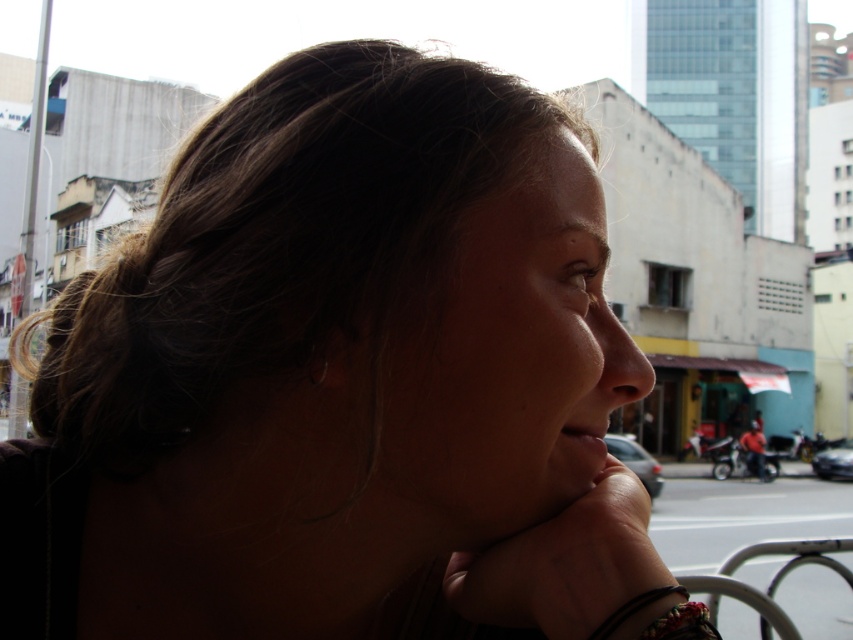
Can you confirm if smooth skin at lower center is wider than black leather bracelet at lower right?

In fact, smooth skin at lower center might be narrower than black leather bracelet at lower right.

Consider the image. Can you confirm if smooth skin at lower center is positioned below black leather bracelet at lower right?

Actually, smooth skin at lower center is above black leather bracelet at lower right.

You are a GUI agent. You are given a task and a screenshot of the screen. Output one action in this format:
    pyautogui.click(x=<x>, y=<y>)
    Task: Click on the smooth skin at lower center
    This screenshot has height=640, width=853.
    Given the screenshot: What is the action you would take?
    point(578,454)

Can you confirm if dark skin hand at lower center is thinner than silver metallic earring at upper left?

In fact, dark skin hand at lower center might be wider than silver metallic earring at upper left.

Which of these two, dark skin hand at lower center or silver metallic earring at upper left, stands taller?

dark skin hand at lower center

Is point (479, 556) closer to viewer compared to point (318, 376)?

No, it is not.

You are a GUI agent. You are given a task and a screenshot of the screen. Output one action in this format:
    pyautogui.click(x=<x>, y=<y>)
    Task: Click on the dark skin hand at lower center
    Image resolution: width=853 pixels, height=640 pixels.
    Given the screenshot: What is the action you would take?
    pyautogui.click(x=566, y=563)

In the scene shown: Can you confirm if shiny metallic bracelet at lower right is shorter than silver metallic earring at upper left?

In fact, shiny metallic bracelet at lower right may be taller than silver metallic earring at upper left.

Is point (674, 634) positioned before point (320, 378)?

Yes, point (674, 634) is in front of point (320, 378).

Who is more forward, (692,636) or (316,381)?

Point (692,636) is more forward.

Find the location of a particular element. shiny metallic bracelet at lower right is located at coordinates (682, 624).